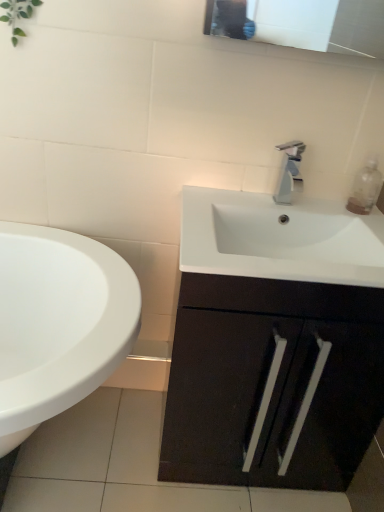
Question: Relative to white glossy sink at lower left, is matte black cabinet at center in front or behind?

Choices:
 (A) behind
 (B) front

Answer: (A)

Question: From a real-world perspective, is matte black cabinet at center physically located above or below white glossy sink at lower left?

Choices:
 (A) above
 (B) below

Answer: (A)

Question: Based on their relative distances, which object is nearer to the white glossy sink at lower left?

Choices:
 (A) matte black cabinet at center
 (B) silver metallic faucet at center
 (C) clear plastic bottle at upper right

Answer: (A)

Question: Which object is the farthest from the matte black cabinet at center?

Choices:
 (A) clear plastic bottle at upper right
 (B) silver metallic faucet at center
 (C) white glossy sink at lower left

Answer: (A)